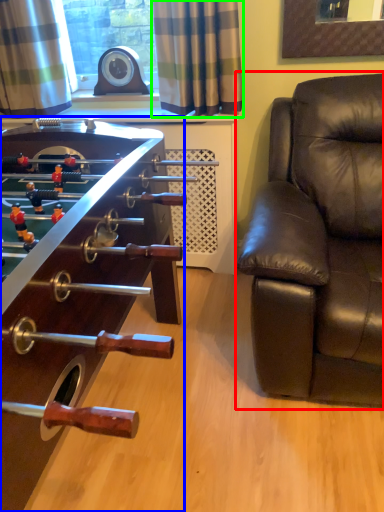
Question: Considering the real-world distances, which object is farthest from studio couch (highlighted by a red box)? table (highlighted by a blue box) or curtain (highlighted by a green box)?

Choices:
 (A) table
 (B) curtain

Answer: (A)